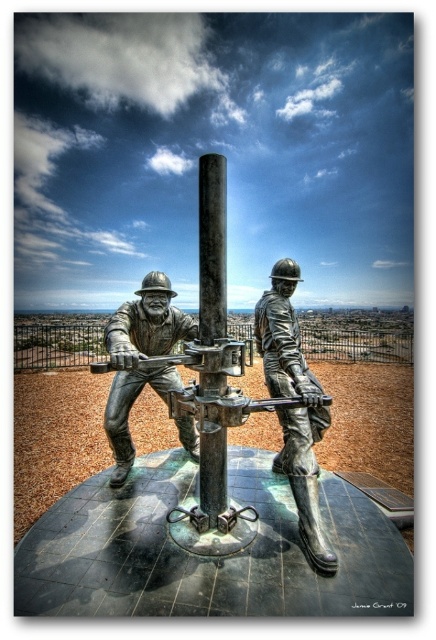
Question: Is polished metal pole at center behind polished bronze rifle at center?

Choices:
 (A) yes
 (B) no

Answer: (A)

Question: Can you confirm if brushed metal statue at center is positioned above bronze statue of man at center?

Choices:
 (A) yes
 (B) no

Answer: (B)

Question: Does bronze/statue at center have a lesser width compared to bronze statue of man at center?

Choices:
 (A) no
 (B) yes

Answer: (A)

Question: Which point is closer to the camera?

Choices:
 (A) bronze statue of man at center
 (B) polished metal pole at center

Answer: (B)

Question: Estimate the real-world distances between objects in this image. Which object is farther from the bronze statue of man at center?

Choices:
 (A) brushed metal statue at center
 (B) polished metal pole at center
 (C) polished bronze rifle at center

Answer: (A)

Question: Which is nearer to the brushed metal statue at center?

Choices:
 (A) polished metal pole at center
 (B) bronze/statue at center
 (C) bronze statue of man at center

Answer: (B)